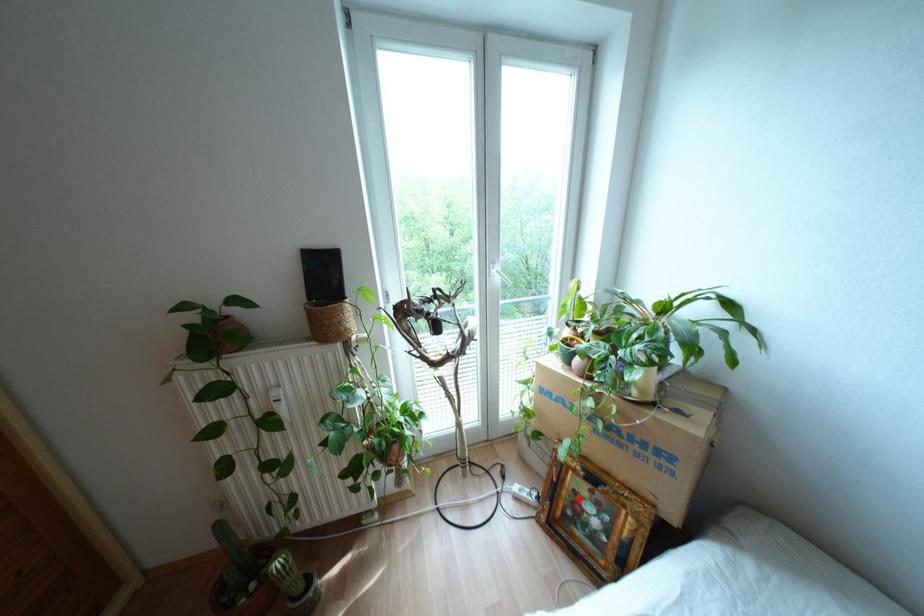
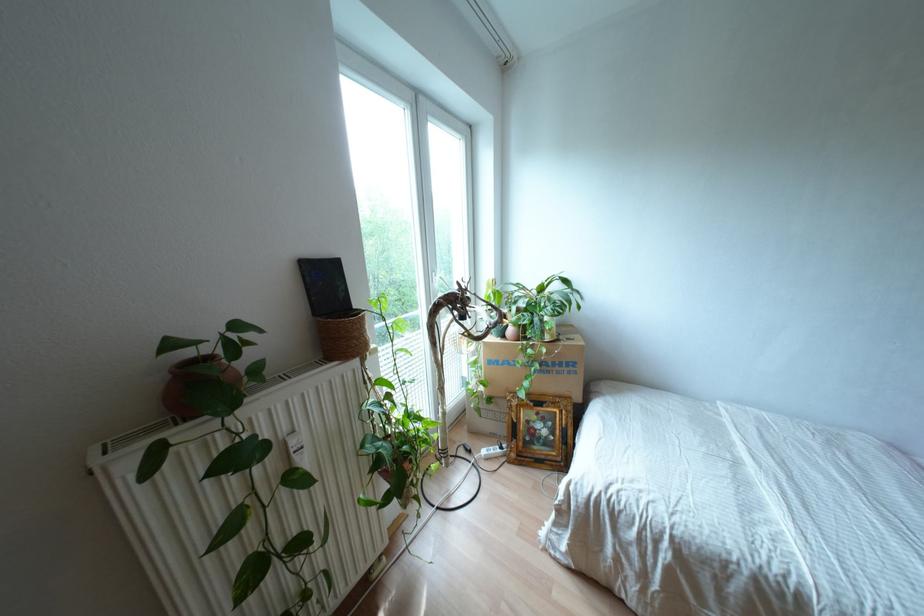
Question: I am providing you with two images of the same scene from different viewpoints. A red point is shown in image1. For the corresponding object point in image2, is it positioned nearer or farther from the camera?

Choices:
 (A) Nearer
 (B) Farther

Answer: (B)